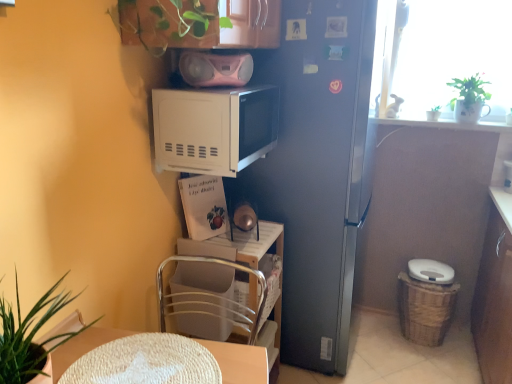
Question: From a real-world perspective, relative to white glossy pot at upper right, acting as the second houseplant starting from the left, is white plastic chair at lower center vertically above or below?

Choices:
 (A) below
 (B) above

Answer: (A)

Question: Is white plastic chair at lower center inside the boundaries of white glossy pot at upper right, acting as the second houseplant starting from the left, or outside?

Choices:
 (A) inside
 (B) outside

Answer: (B)

Question: Which is farther from the satin silver refrigerator at center?

Choices:
 (A) pink plastic boombox at upper center
 (B) green leafy plant at lower left, which appears as the 1th houseplant when viewed from the front
 (C) white plastic chair at lower center
 (D) woven brown basket at lower right
 (E) white woven placemat at lower center

Answer: (B)

Question: Considering the real-world distances, which object is farthest from the white glossy pot at upper right, the 1th houseplant positioned from the back?

Choices:
 (A) satin silver refrigerator at center
 (B) white matte microwave at upper center
 (C) white plastic chair at lower center
 (D) green matte plant at upper right, which is the 1th houseplant in right-to-left order
 (E) white woven placemat at lower center

Answer: (E)